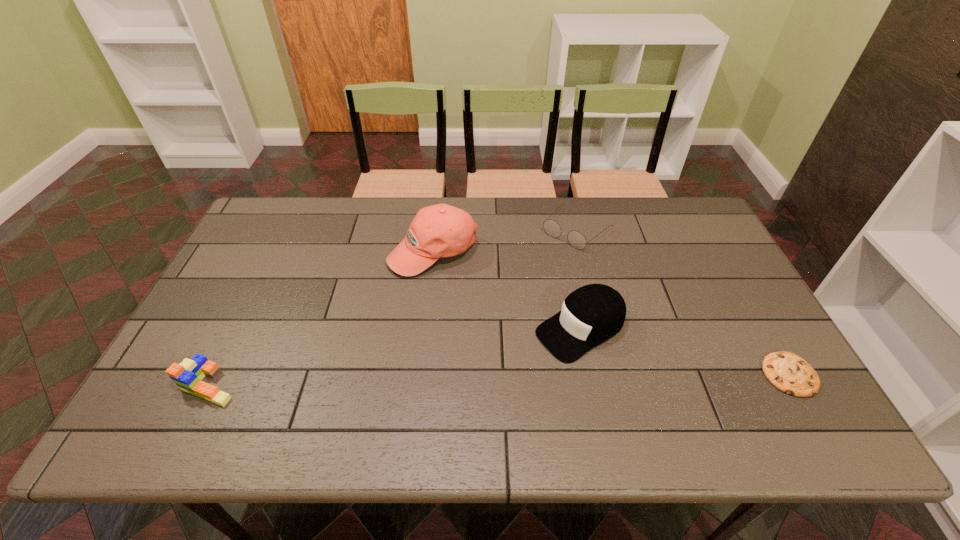
Where is `Lego`? This screenshot has width=960, height=540. Lego is located at coordinates (187, 375).

Where is `cookie`? cookie is located at coordinates (789, 373).

Find the location of a particular element. the shortest object is located at coordinates (789, 373).

This screenshot has height=540, width=960. I want to click on the second shortest object, so pos(576,239).

Where is `baseball cap`? baseball cap is located at coordinates (441, 230).

Find the location of a particular element. This screenshot has width=960, height=540. the fourth object from right to left is located at coordinates (441, 230).

The image size is (960, 540). What are the coordinates of `the fourth shortest object` in the screenshot? It's located at (590, 315).

Find the location of `free location located on the back of the Lego`. free location located on the back of the Lego is located at coordinates (264, 276).

Find the location of a particular element. vacant space located 0.090m on the left of the shortest object is located at coordinates 727,375.

The width and height of the screenshot is (960, 540). Identify the location of blank space located 0.070m on the temples of the spectacles. (545, 259).